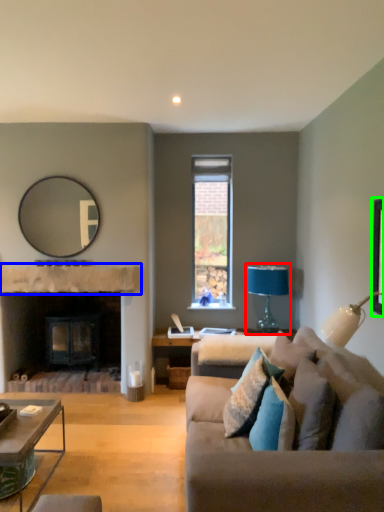
Question: Which is farther away from table lamp (highlighted by a red box)? mantle (highlighted by a blue box) or picture frame (highlighted by a green box)?

Choices:
 (A) mantle
 (B) picture frame

Answer: (B)